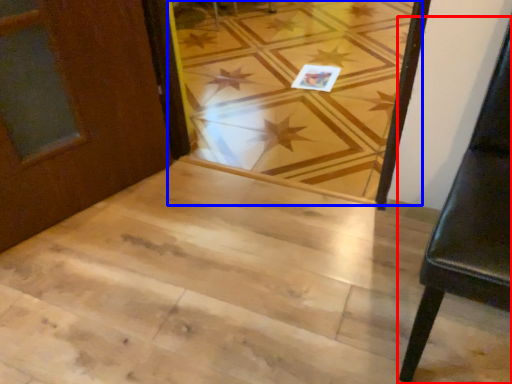
Question: Among these objects, which one is nearest to the camera, furniture (highlighted by a red box) or plank (highlighted by a blue box)?

Choices:
 (A) furniture
 (B) plank

Answer: (A)